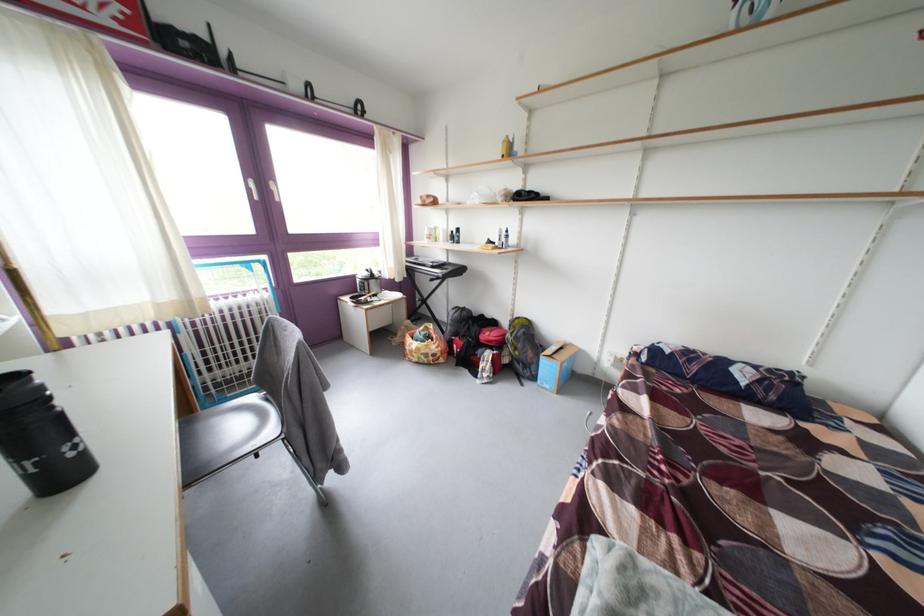
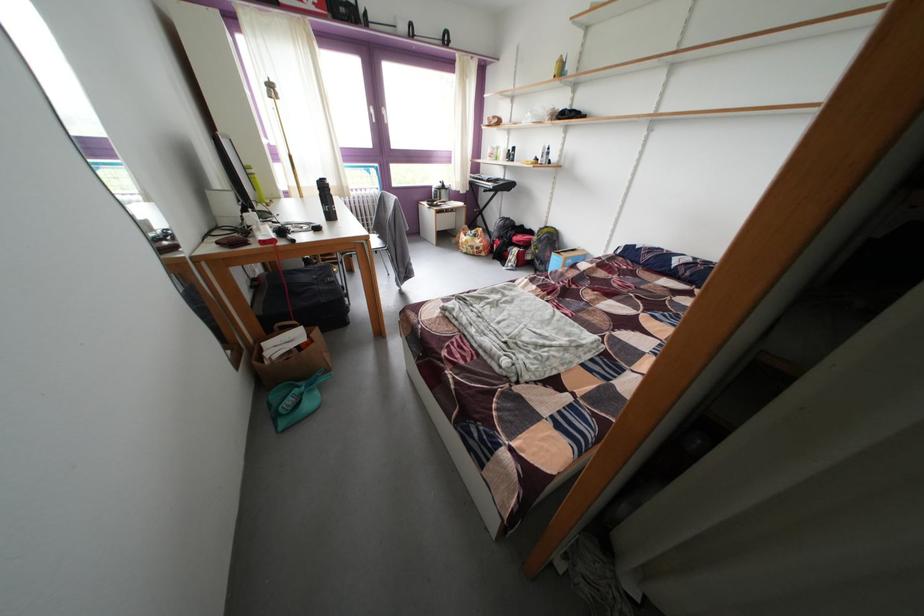
In the second image, find the point that corresponds to (419,345) in the first image.

(472, 241)